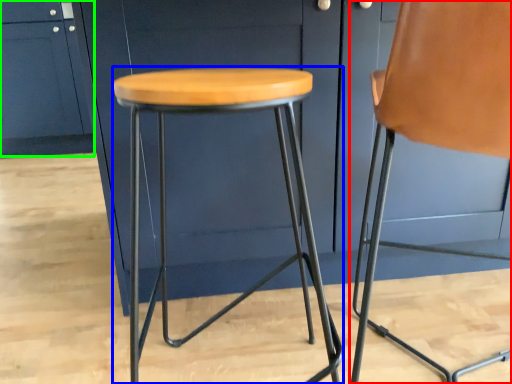
Question: Estimate the real-world distances between objects in this image. Which object is closer to chair (highlighted by a red box), stool (highlighted by a blue box) or cabinetry (highlighted by a green box)?

Choices:
 (A) stool
 (B) cabinetry

Answer: (A)